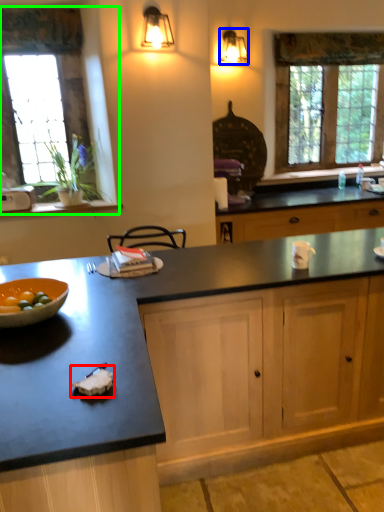
Question: Considering the real-world distances, which object is farthest from food (highlighted by a red box)? light fixture (highlighted by a blue box) or window (highlighted by a green box)?

Choices:
 (A) light fixture
 (B) window

Answer: (A)